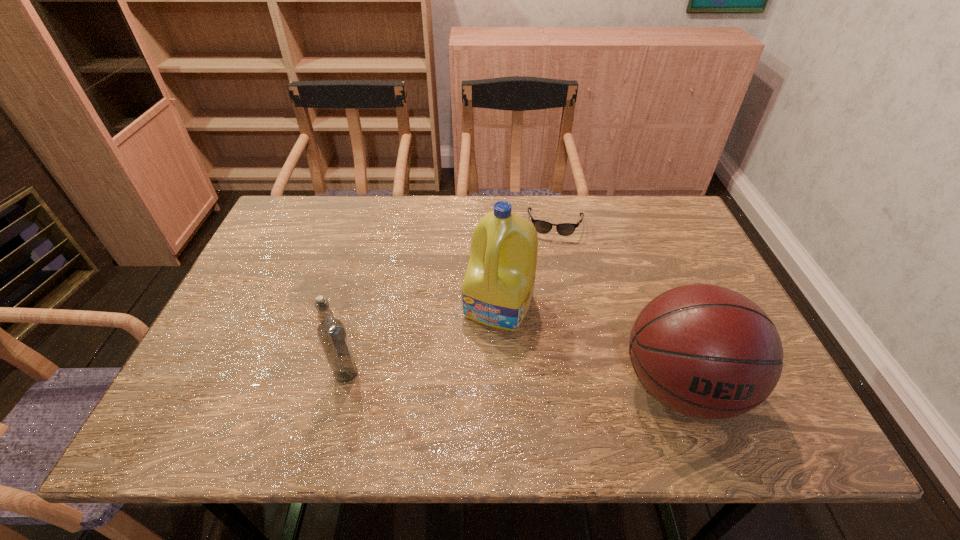
The image size is (960, 540). I want to click on object identified as the third closest to the detergent, so click(x=331, y=332).

Identify which object is the second closest to the third nearest object. Please provide its 2D coordinates. Your answer should be formatted as a tuple, i.e. [(x, y)], where the tuple contains the x and y coordinates of a point satisfying the conditions above.

[(565, 229)]

You are a GUI agent. You are given a task and a screenshot of the screen. Output one action in this format:
    pyautogui.click(x=<x>, y=<y>)
    Task: Click on the free space that satisfies the following two spatial constraints: 1. on the front side of the basketball; 2. on the left side of the sunglasses
    This screenshot has height=540, width=960.
    Given the screenshot: What is the action you would take?
    pyautogui.click(x=588, y=387)

The image size is (960, 540). Find the location of `free space in the image that satisfies the following two spatial constraints: 1. on the front side of the basketball; 2. on the left side of the shortest object`. free space in the image that satisfies the following two spatial constraints: 1. on the front side of the basketball; 2. on the left side of the shortest object is located at coordinates (588, 387).